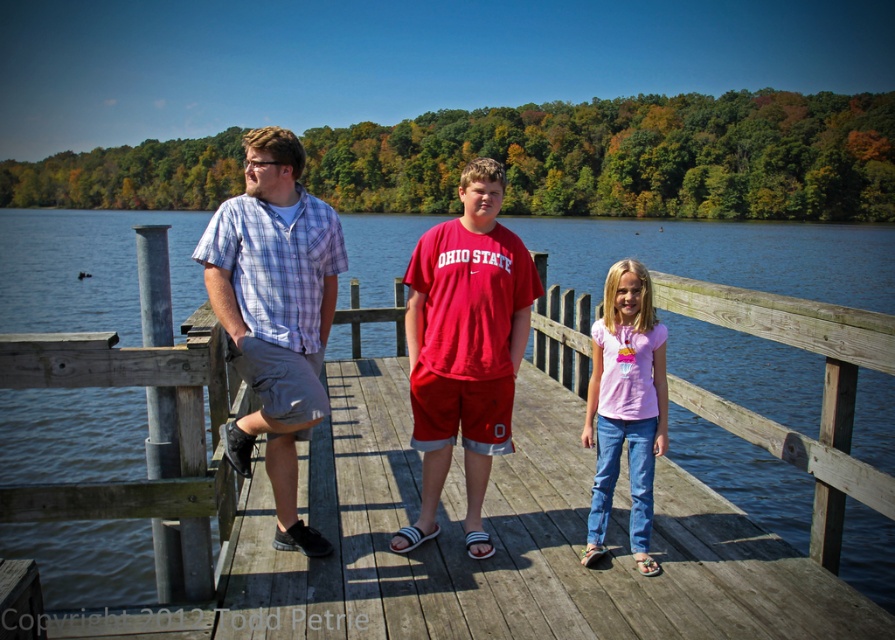
Question: Is red matte t-shirt at center above pink cotton shirt at center?

Choices:
 (A) no
 (B) yes

Answer: (B)

Question: Is transparent water at dock center thinner than plaid cotton shirt at center?

Choices:
 (A) no
 (B) yes

Answer: (A)

Question: Which point is closer to the camera?

Choices:
 (A) (490, 216)
 (B) (241, 196)
 (C) (655, 416)

Answer: (B)

Question: Does transparent water at dock center have a larger size compared to plaid cotton shirt at center?

Choices:
 (A) no
 (B) yes

Answer: (B)

Question: Among these points, which one is farthest from the camera?

Choices:
 (A) (439, 397)
 (B) (109, 250)
 (C) (599, 332)

Answer: (B)

Question: Which object is closer to the camera taking this photo?

Choices:
 (A) red matte t-shirt at center
 (B) plaid cotton shirt at center

Answer: (B)